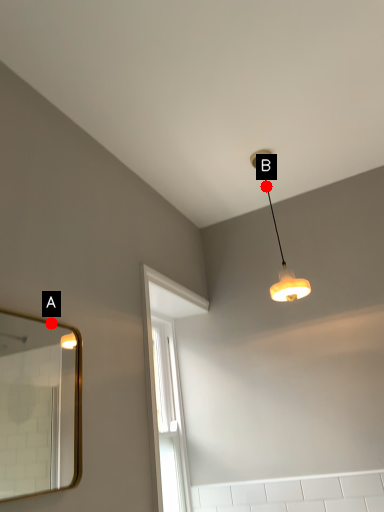
Question: Two points are circled on the image, labeled by A and B beside each circle. Among these points, which one is nearest to the camera?

Choices:
 (A) A is closer
 (B) B is closer

Answer: (A)